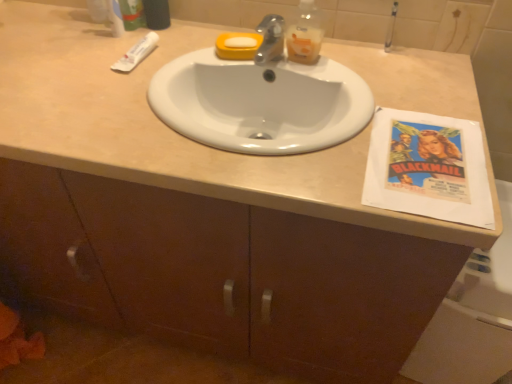
This screenshot has width=512, height=384. What are the coordinates of `vacant area located to the right-hand side of green matte toothpaste tube at upper left` in the screenshot? It's located at (194, 33).